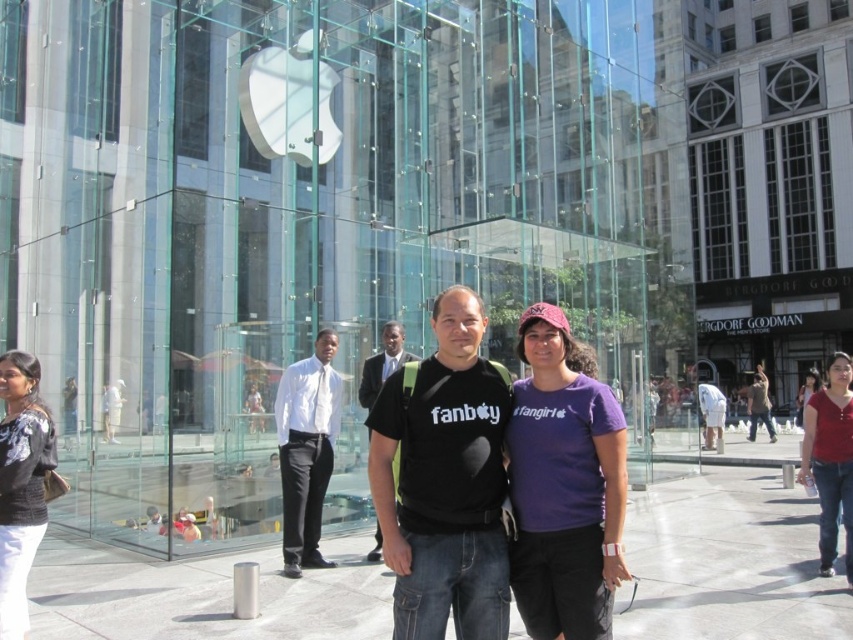
Question: Based on their relative distances, which object is farther from the red cotton shirt at lower right?

Choices:
 (A) white glossy shirt at center
 (B) brown leather jacket at center
 (C) black fabric shirt at center

Answer: (B)

Question: Which of the following is the closest to the observer?

Choices:
 (A) white cotton shirt at lower left
 (B) white cotton shirt at center

Answer: (A)

Question: Does purple cotton t-shirt at center have a lesser width compared to white cotton shirt at lower left?

Choices:
 (A) no
 (B) yes

Answer: (A)

Question: Is concrete at center behind matte red shirt at center?

Choices:
 (A) yes
 (B) no

Answer: (B)

Question: Which object appears farthest from the camera in this image?

Choices:
 (A) black matte t-shirt at center
 (B) white glossy shirt at center

Answer: (B)

Question: Does brown leather jacket at center have a lesser width compared to matte red shirt at center?

Choices:
 (A) yes
 (B) no

Answer: (B)